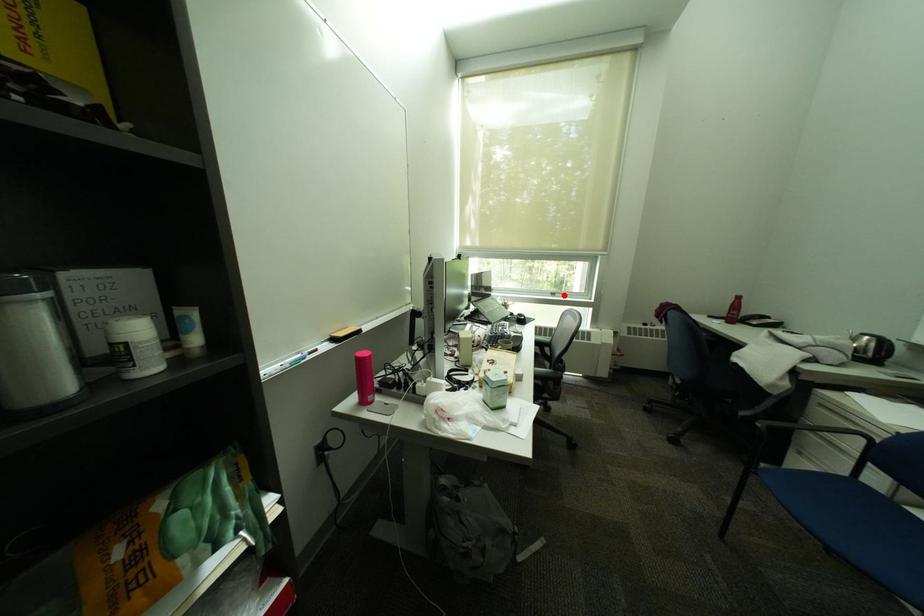
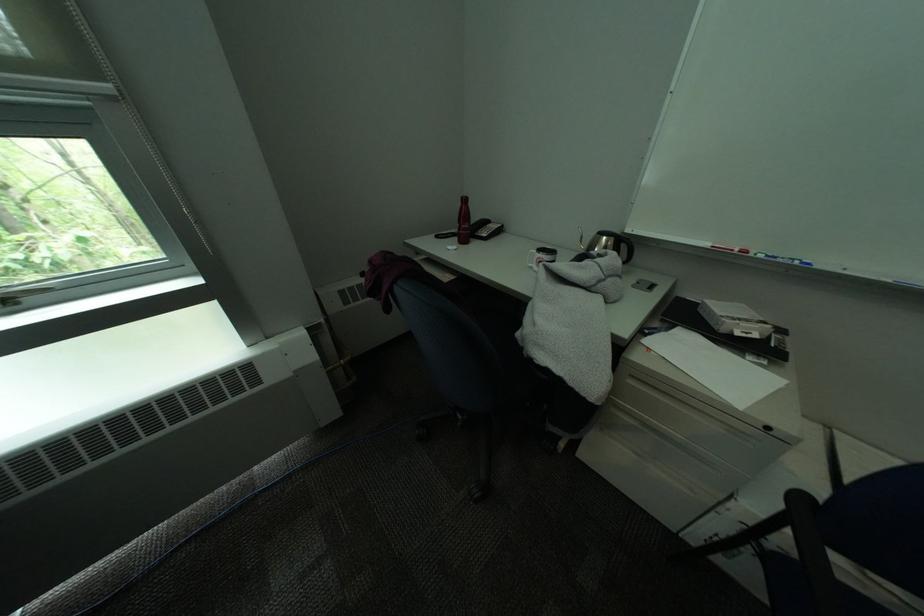
Locate, in the second image, the point that corresponds to the highlighted location in the first image.

(15, 302)